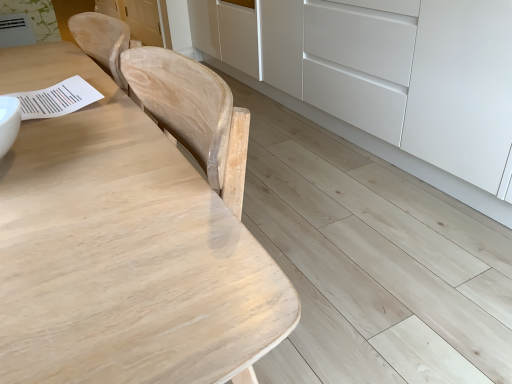
Question: From the image's perspective, is white matte cabinet at lower right on top of natural wood table at upper left?

Choices:
 (A) yes
 (B) no

Answer: (A)

Question: From a real-world perspective, is white matte cabinet at lower right over natural wood table at upper left?

Choices:
 (A) no
 (B) yes

Answer: (A)

Question: Is the position of white matte cabinet at lower right less distant than that of natural wood table at upper left?

Choices:
 (A) yes
 (B) no

Answer: (B)

Question: Considering the relative sizes of white matte cabinet at lower right and natural wood table at upper left in the image provided, is white matte cabinet at lower right shorter than natural wood table at upper left?

Choices:
 (A) yes
 (B) no

Answer: (A)

Question: Considering the relative sizes of white matte cabinet at lower right and natural wood table at upper left in the image provided, is white matte cabinet at lower right thinner than natural wood table at upper left?

Choices:
 (A) no
 (B) yes

Answer: (A)

Question: Is white matte cabinet at lower right aimed at natural wood table at upper left?

Choices:
 (A) no
 (B) yes

Answer: (B)

Question: Is natural wood table at upper left to the right of white matte cabinet at lower right from the viewer's perspective?

Choices:
 (A) no
 (B) yes

Answer: (A)

Question: Considering the relative sizes of natural wood table at upper left and white matte cabinet at lower right in the image provided, is natural wood table at upper left shorter than white matte cabinet at lower right?

Choices:
 (A) yes
 (B) no

Answer: (B)

Question: Is natural wood table at upper left smaller than white matte cabinet at lower right?

Choices:
 (A) no
 (B) yes

Answer: (B)

Question: Could you tell me if natural wood table at upper left is turned towards white matte cabinet at lower right?

Choices:
 (A) yes
 (B) no

Answer: (B)

Question: Is natural wood table at upper left beside white matte cabinet at lower right?

Choices:
 (A) no
 (B) yes

Answer: (A)

Question: Is natural wood table at upper left facing away from white matte cabinet at lower right?

Choices:
 (A) no
 (B) yes

Answer: (B)

Question: Does point (352, 8) appear closer or farther from the camera than point (79, 269)?

Choices:
 (A) closer
 (B) farther

Answer: (B)